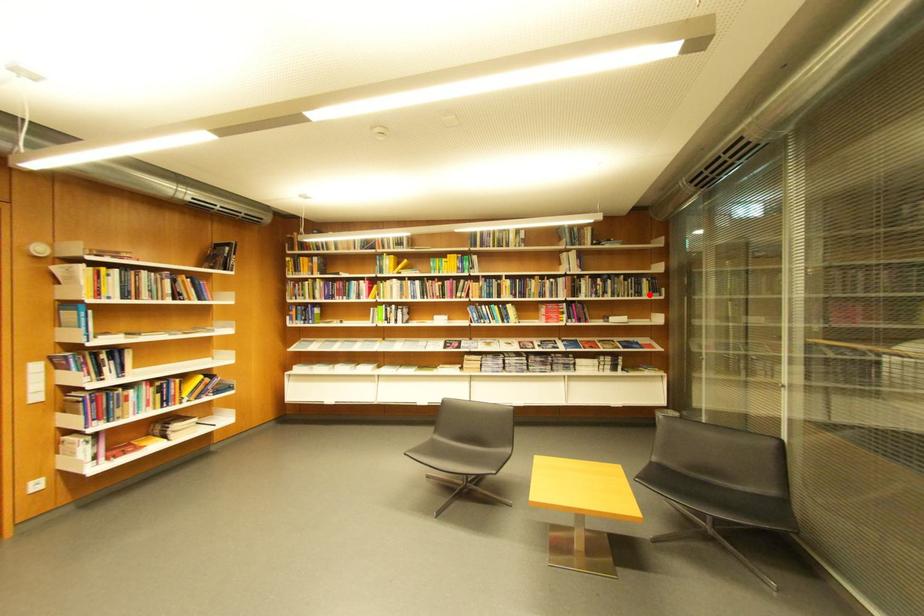
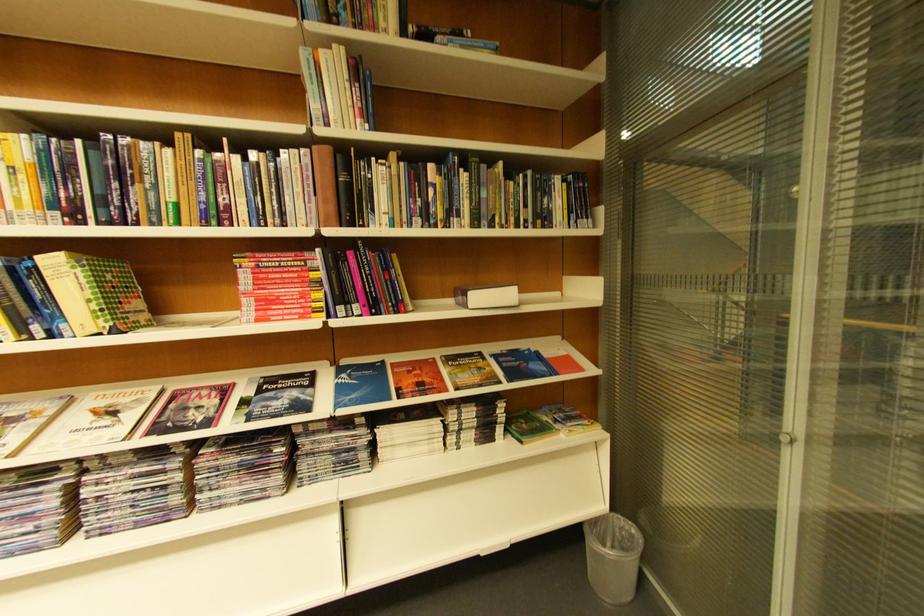
Where in the second image is the point corresponding to the highlighted location from the first image?

(554, 221)